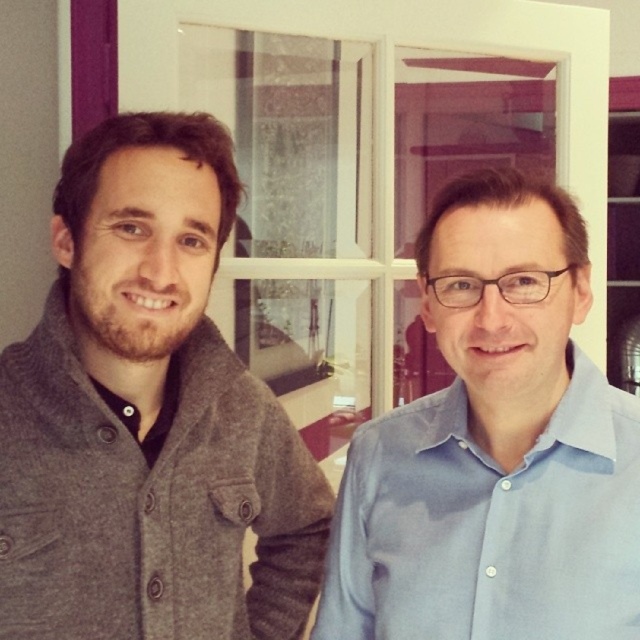
You are a fashion designer assessing the fit of clothing items in the image. You notice the gray woolen sweater at left and the light blue cotton shirt at right. Which clothing item has a narrower width?

The gray woolen sweater at left has a narrower width than the light blue cotton shirt at right.

You are standing in the room where the two people are. You want to place a small decoration on the point closer to you between the two points labeled point (x=112, y=188) and point (x=448, y=499). Which point should you choose?

You should choose point (x=112, y=188) because it is closer to the viewer than point (x=448, y=499).

You are a photographer adjusting the lighting for a photo shoot. You notice a gray woolen sweater at left located at point (147, 417). Since the window is behind the subjects, will the sweater be illuminated by the window light?

The gray woolen sweater at left is located at point (147, 417). Since the window is behind the subjects, the light from the window would cast their shadows towards the sweater. This could potentially block the direct light from reaching the sweater, resulting in shadowed areas on it.